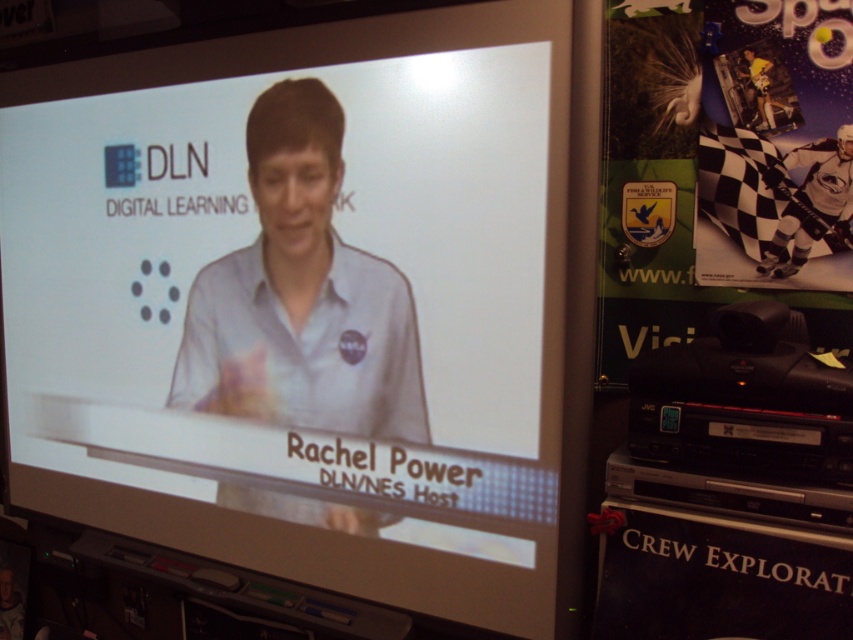
You are an attendee at a conference and want to take a photo of the white glossy screen at center and the green matte poster at right. Since you can only take one photo, which object will be fully visible in the photo if you stand where you are?

The white glossy screen at center is in front of the green matte poster at right, so the white glossy screen at center will be fully visible while the green matte poster at right might be partially obscured.

You are standing in a room and see the white glossy screen at center. If you want to locate the screen precisely, what are its coordinates?

The white glossy screen at center is located at coordinates point (300,301).

What is the color and material of the poster located at the position marked by the point (724,168)?

The poster at point (724,168) is green and matte in material.